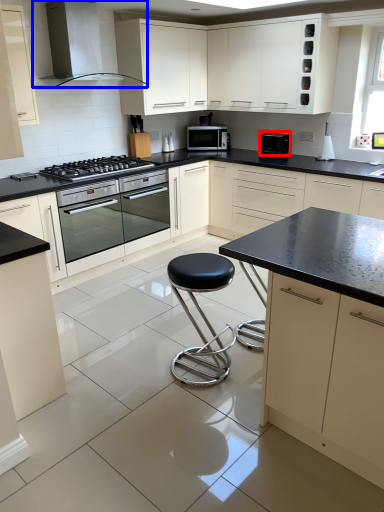
Question: Which point is further to the camera, kitchen appliance (highlighted by a red box) or home appliance (highlighted by a blue box)?

Choices:
 (A) kitchen appliance
 (B) home appliance

Answer: (A)